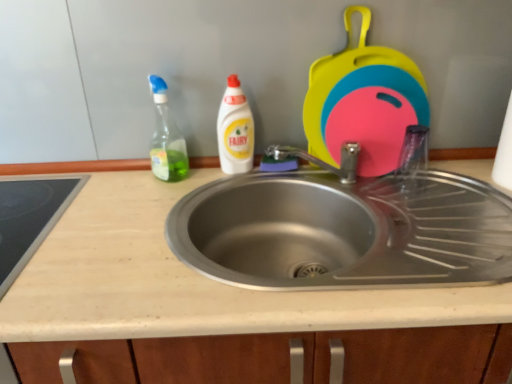
At what (x,y) coordinates should I click in order to perform the action: click on vacant point above smooth glass cooktop at left, the 2th appliance viewed from the right (from a real-world perspective). Please return your answer as a coordinate pair (x, y). The height and width of the screenshot is (384, 512). Looking at the image, I should click on (26, 208).